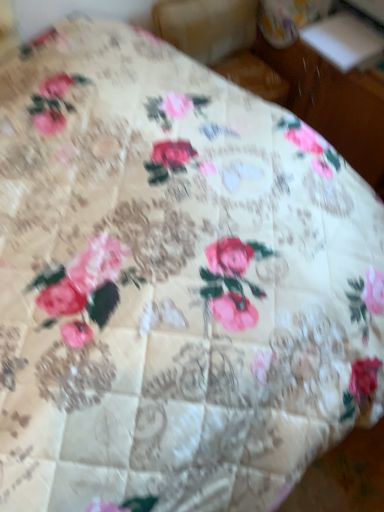
Image resolution: width=384 pixels, height=512 pixels. Describe the element at coordinates (334, 103) in the screenshot. I see `wooden dresser at upper right` at that location.

This screenshot has width=384, height=512. I want to click on wooden dresser at upper right, so click(334, 103).

Locate an element on the screen. wooden dresser at upper right is located at coordinates (334, 103).